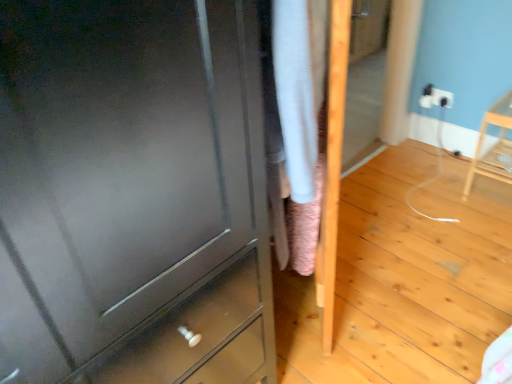
Question: Can you confirm if light wood chair at right is bigger than matte gray chest of drawers at center?

Choices:
 (A) no
 (B) yes

Answer: (A)

Question: Would you say light wood chair at right is outside matte gray chest of drawers at center?

Choices:
 (A) no
 (B) yes

Answer: (B)

Question: Considering the relative sizes of light wood chair at right and matte gray chest of drawers at center in the image provided, is light wood chair at right thinner than matte gray chest of drawers at center?

Choices:
 (A) yes
 (B) no

Answer: (A)

Question: From the image's perspective, is light wood chair at right over matte gray chest of drawers at center?

Choices:
 (A) yes
 (B) no

Answer: (A)

Question: Can you confirm if light wood chair at right is smaller than matte gray chest of drawers at center?

Choices:
 (A) yes
 (B) no

Answer: (A)

Question: Is matte gray chest of drawers at center wider or thinner than light wood chair at right?

Choices:
 (A) thin
 (B) wide

Answer: (B)

Question: Considering the positions of matte gray chest of drawers at center and light wood chair at right in the image, is matte gray chest of drawers at center bigger or smaller than light wood chair at right?

Choices:
 (A) small
 (B) big

Answer: (B)

Question: In terms of height, does matte gray chest of drawers at center look taller or shorter compared to light wood chair at right?

Choices:
 (A) short
 (B) tall

Answer: (B)

Question: Based on their positions, is matte gray chest of drawers at center located to the left or right of light wood chair at right?

Choices:
 (A) right
 (B) left

Answer: (B)

Question: Is white plastic electric outlet at upper right inside the boundaries of matte gray chest of drawers at center, or outside?

Choices:
 (A) outside
 (B) inside

Answer: (A)

Question: Visually, is white plastic electric outlet at upper right positioned to the left or to the right of matte gray chest of drawers at center?

Choices:
 (A) left
 (B) right

Answer: (B)

Question: In the image, is white plastic electric outlet at upper right positioned in front of or behind matte gray chest of drawers at center?

Choices:
 (A) behind
 (B) front

Answer: (A)

Question: Is point (423, 104) closer or farther from the camera than point (82, 195)?

Choices:
 (A) closer
 (B) farther

Answer: (B)

Question: Is light wood chair at right in front of or behind matte gray chest of drawers at center in the image?

Choices:
 (A) front
 (B) behind

Answer: (B)

Question: Looking at their shapes, would you say light wood chair at right is wider or thinner than matte gray chest of drawers at center?

Choices:
 (A) wide
 (B) thin

Answer: (B)